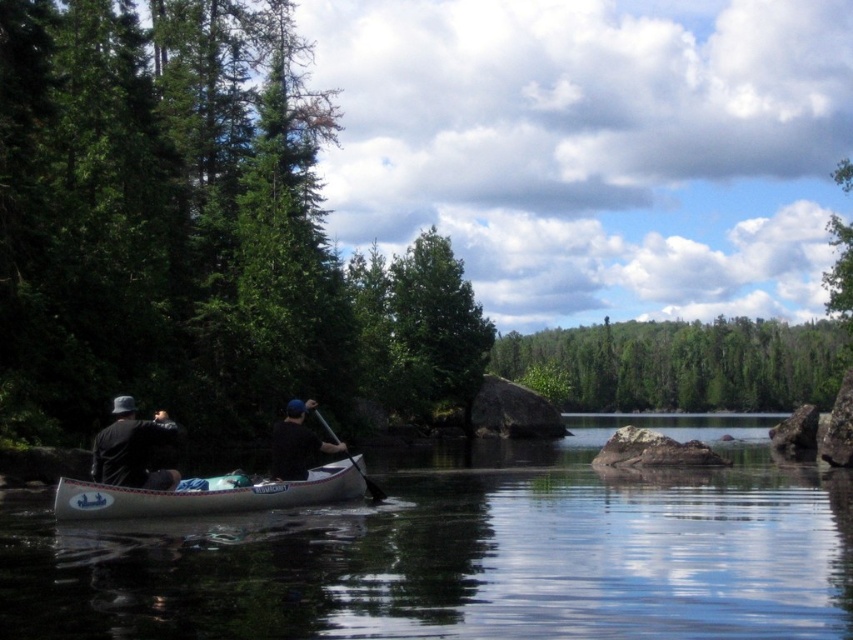
Can you confirm if white plastic canoe at center is thinner than black matte paddle at center?

Yes.

Is white plastic canoe at center taller than black matte paddle at center?

In fact, white plastic canoe at center may be shorter than black matte paddle at center.

Is point (129, 486) farther from camera compared to point (300, 428)?

No, (129, 486) is closer to viewer.

This screenshot has width=853, height=640. In order to click on white plastic canoe at center in this screenshot , I will do `click(209, 496)`.

Is green leafy tree at left bigger than black matte paddle at center?

Indeed, green leafy tree at left has a larger size compared to black matte paddle at center.

Can you confirm if green leafy tree at left is positioned to the left of black matte paddle at center?

Indeed, green leafy tree at left is positioned on the left side of black matte paddle at center.

Find the location of a particular element. green leafy tree at left is located at coordinates (178, 227).

Can you confirm if green leafy tree at center is positioned to the left of wooden smooth paddle at center?

Incorrect, green leafy tree at center is not on the left side of wooden smooth paddle at center.

Between point (447, 332) and point (334, 435), which one is positioned behind?

The point (447, 332) is more distant.

The width and height of the screenshot is (853, 640). What do you see at coordinates (438, 323) in the screenshot? I see `green leafy tree at center` at bounding box center [438, 323].

In order to click on green leafy tree at center in this screenshot , I will do `click(438, 323)`.